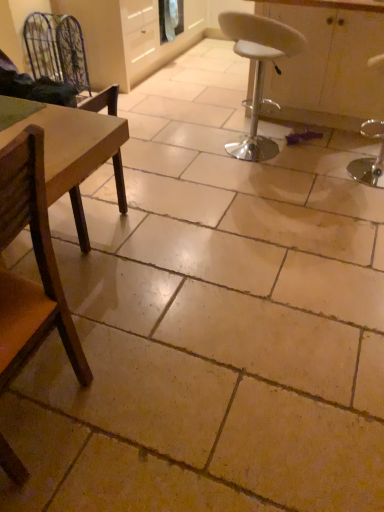
Question: Which direction should I rotate to face white plastic stool at center, the third chair positioned from the left, — up or down?

Choices:
 (A) up
 (B) down

Answer: (A)

Question: Is white glossy cabinet at center outside of white plastic stool at center, the third chair positioned from the left?

Choices:
 (A) yes
 (B) no

Answer: (A)

Question: From a real-world perspective, is white glossy cabinet at center below white plastic stool at center, which is counted as the first chair, starting from the right?

Choices:
 (A) yes
 (B) no

Answer: (B)

Question: From the image's perspective, is white glossy cabinet at center on top of white plastic stool at center, which is counted as the first chair, starting from the right?

Choices:
 (A) yes
 (B) no

Answer: (A)

Question: Does white glossy cabinet at center turn towards white plastic stool at center, the third chair viewed from the front?

Choices:
 (A) yes
 (B) no

Answer: (A)

Question: Would you consider white glossy cabinet at center to be distant from white plastic stool at center, the third chair positioned from the left?

Choices:
 (A) no
 (B) yes

Answer: (A)

Question: Considering the relative sizes of white glossy cabinet at center and white plastic stool at center, the third chair positioned from the left, in the image provided, is white glossy cabinet at center thinner than white plastic stool at center, the third chair positioned from the left,?

Choices:
 (A) no
 (B) yes

Answer: (A)

Question: Is wooden chair at left, the second chair in the back-to-front sequence, looking in the opposite direction of white glossy cabinet at center?

Choices:
 (A) yes
 (B) no

Answer: (A)

Question: From a real-world perspective, is wooden chair at left, the 2th chair viewed from the front, physically above white glossy cabinet at center?

Choices:
 (A) yes
 (B) no

Answer: (B)

Question: Does wooden chair at left, the 2th chair viewed from the front, have a greater width compared to white glossy cabinet at center?

Choices:
 (A) no
 (B) yes

Answer: (A)

Question: Can you confirm if wooden chair at left, the 3th chair positioned from the right, is thinner than white glossy cabinet at center?

Choices:
 (A) no
 (B) yes

Answer: (B)

Question: From the image's perspective, is wooden chair at left, the second chair in the back-to-front sequence, beneath white glossy cabinet at center?

Choices:
 (A) yes
 (B) no

Answer: (A)

Question: Is wooden chair at left, the 3th chair positioned from the right, next to white glossy cabinet at center and touching it?

Choices:
 (A) yes
 (B) no

Answer: (B)

Question: Could you tell me if metallic wire swivel chair at upper left is turned towards brown wooden chair at left, which is the first chair in front-to-back order?

Choices:
 (A) no
 (B) yes

Answer: (A)